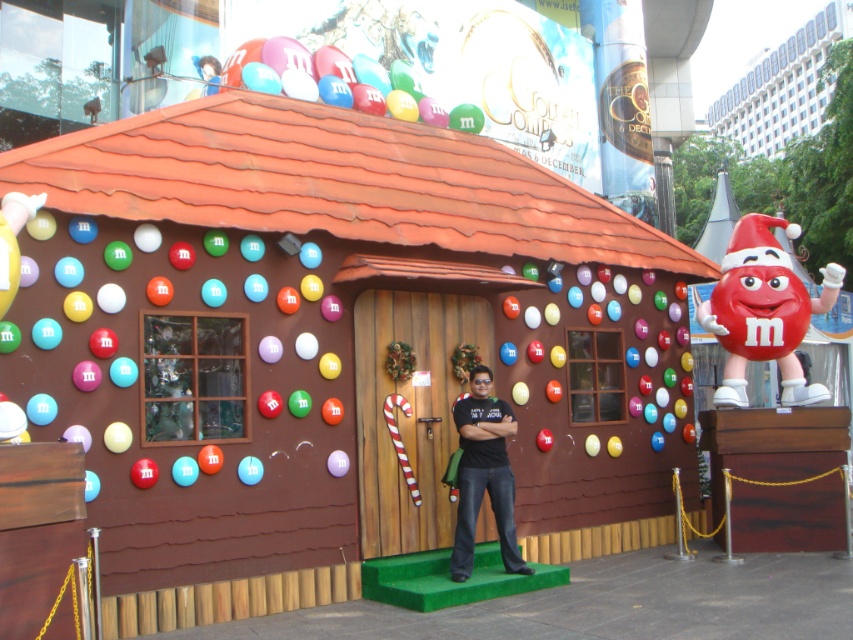
Question: Can you confirm if smooth red candy at right is thinner than shiny plastic balloon at upper center?

Choices:
 (A) yes
 (B) no

Answer: (A)

Question: Which point appears closest to the camera in this image?

Choices:
 (A) (341, 60)
 (B) (785, 60)
 (C) (497, 500)

Answer: (C)

Question: Can you confirm if smooth red candy at right is wider than white glass building at upper right?

Choices:
 (A) no
 (B) yes

Answer: (A)

Question: Which point is closer to the camera?

Choices:
 (A) (747, 326)
 (B) (755, 147)
 (C) (305, 506)
 (D) (312, 65)

Answer: (C)

Question: Which of the following is the farthest from the observer?

Choices:
 (A) (457, 477)
 (B) (403, 74)

Answer: (B)

Question: Is smooth red candy at right in front of shiny plastic balloon at upper center?

Choices:
 (A) no
 (B) yes

Answer: (B)